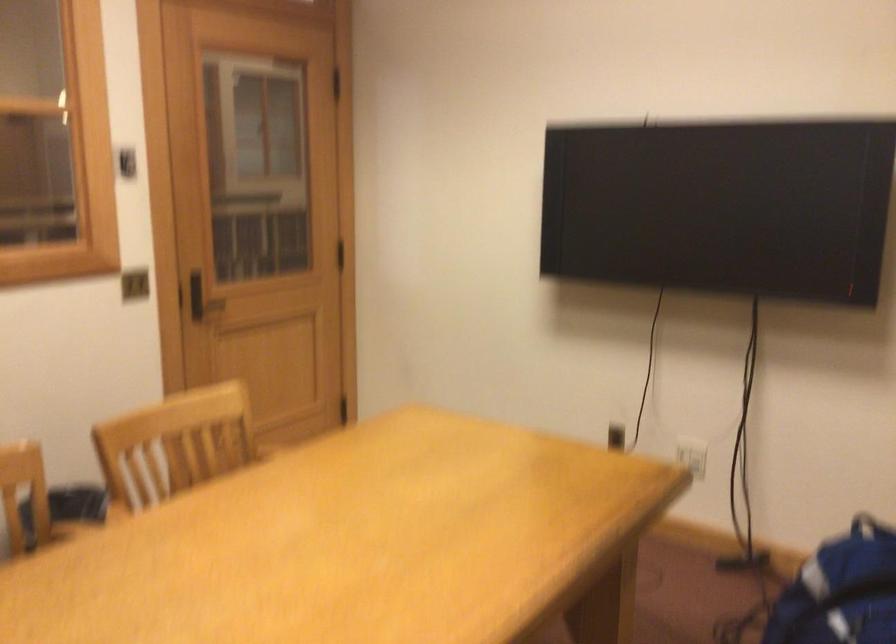
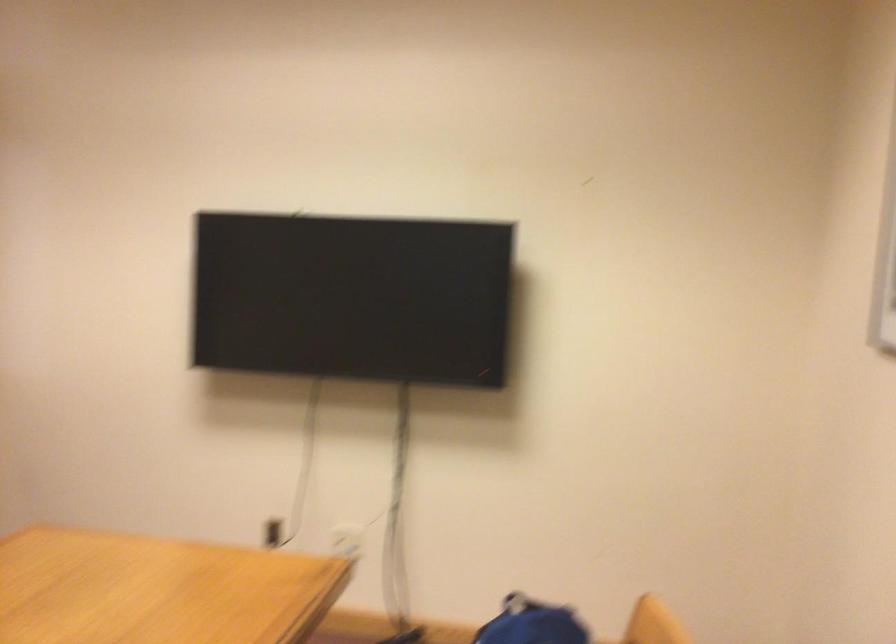
Which direction would the cameraman need to move to produce the second image?

The movement direction of the cameraman is left, forward.